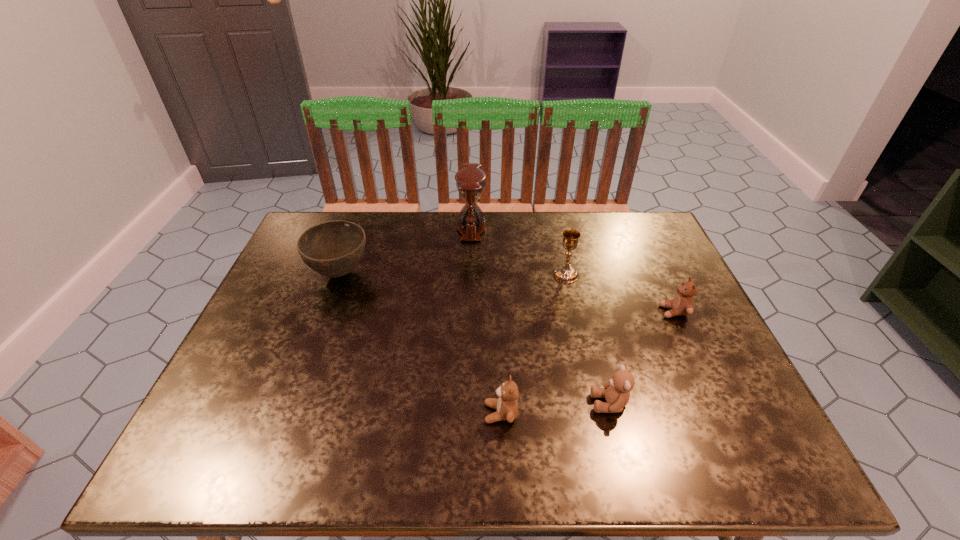
Where is `hourglass at the far edge`? This screenshot has height=540, width=960. hourglass at the far edge is located at coordinates (470, 181).

Where is `bowl that is at the far edge`? bowl that is at the far edge is located at coordinates (333, 249).

What are the coordinates of `object that is at the near edge` in the screenshot? It's located at (506, 405).

The image size is (960, 540). I want to click on object present at the left edge, so click(x=333, y=249).

You are a GUI agent. You are given a task and a screenshot of the screen. Output one action in this format:
    pyautogui.click(x=<x>, y=<y>)
    Task: Click on the object that is at the right edge
    Image resolution: width=960 pixels, height=540 pixels.
    Given the screenshot: What is the action you would take?
    pyautogui.click(x=682, y=304)

Identify the location of object located in the far left corner section of the desktop. The height and width of the screenshot is (540, 960). (333, 249).

Identify the location of vacant region at the far edge. Image resolution: width=960 pixels, height=540 pixels. (372, 225).

Where is `vacant space at the near edge of the desktop`? vacant space at the near edge of the desktop is located at coordinates (617, 466).

Image resolution: width=960 pixels, height=540 pixels. In order to click on free space at the left edge of the desktop in this screenshot , I will do `click(284, 349)`.

Find the location of a particular element. This screenshot has width=960, height=540. free region at the right edge of the desktop is located at coordinates (690, 383).